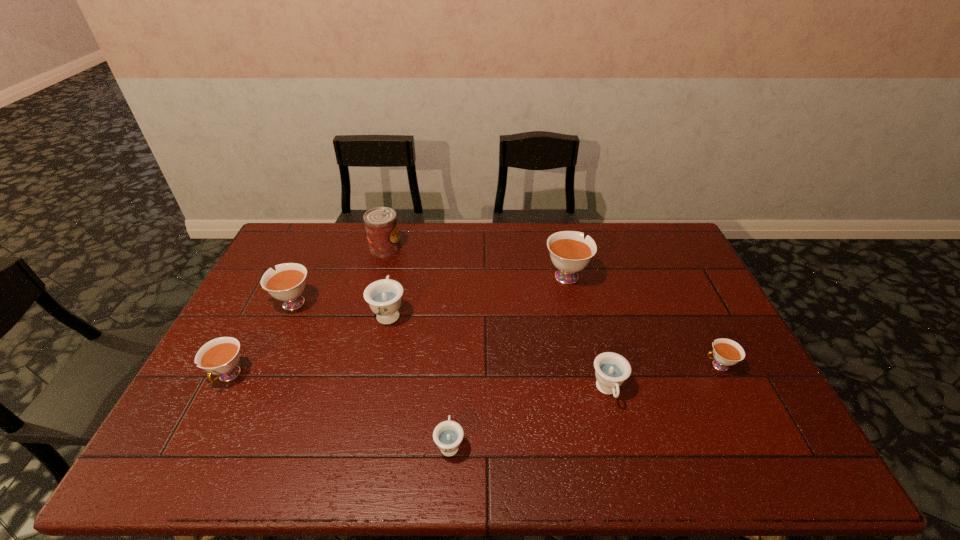
The width and height of the screenshot is (960, 540). I want to click on object positioned at the near edge, so click(448, 435).

I want to click on object located in the right edge section of the desktop, so click(x=726, y=352).

Identify the location of vacant space at the far edge of the desktop. The height and width of the screenshot is (540, 960). (346, 239).

The height and width of the screenshot is (540, 960). I want to click on free space at the near edge of the desktop, so click(626, 453).

In the image, there is a desktop. Identify the location of vacant region at the far left corner. The width and height of the screenshot is (960, 540). (279, 255).

Identify the location of blank space at the near left corner of the desktop. (195, 450).

I want to click on unoccupied position between the second nearest blue teacup and the farthest object, so click(496, 319).

Locate an element on the screen. The image size is (960, 540). vacant area between the second farthest blue teacup and the third smallest white teacup is located at coordinates (449, 347).

This screenshot has width=960, height=540. Identify the location of free space between the fourth teacup from right to left and the second biggest white teacup. (371, 374).

Find the location of a particular element. free space between the can and the third biggest white teacup is located at coordinates (307, 312).